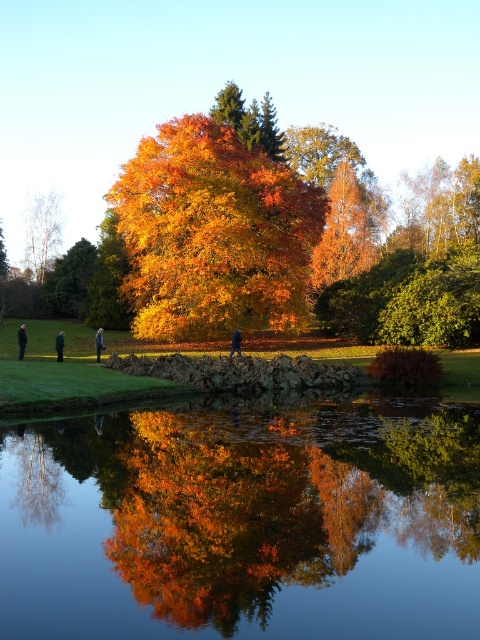
You are standing at the edge of the pond and want to take a photo of the point at coordinates point [169,230]. If your camera has a maximum focus range of 150 feet, will it be able to focus on that point?

The distance of point [169,230] from the camera is 144.95 feet, which is within the camera maximum focus range of 150 feet. Therefore, the camera can focus on that point.